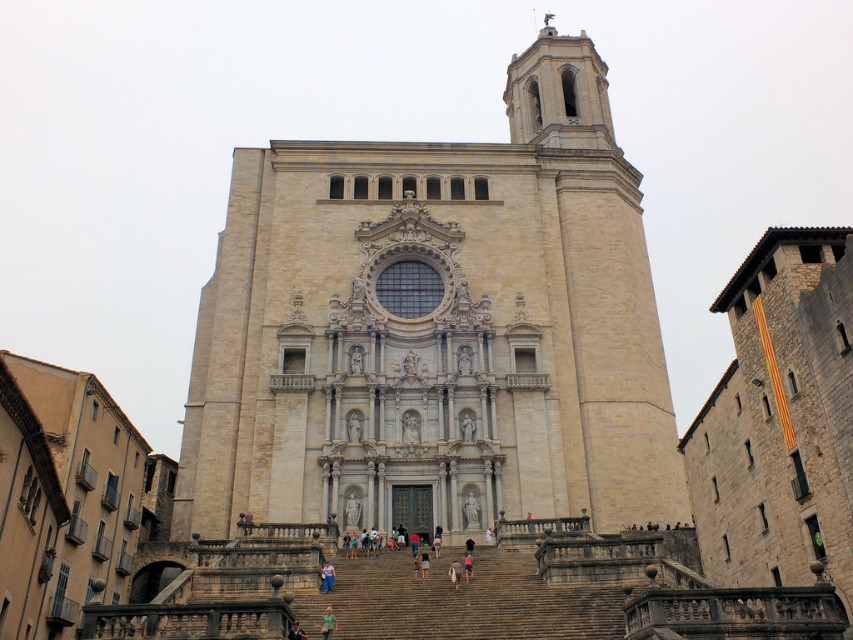
Question: Is green fabric bag at center bigger than light brown stone person at center?

Choices:
 (A) yes
 (B) no

Answer: (A)

Question: Does light brown stone person at center have a lesser width compared to green fabric shirt at center?

Choices:
 (A) no
 (B) yes

Answer: (B)

Question: Which point is closer to the camera taking this photo?

Choices:
 (A) (451, 563)
 (B) (329, 637)
 (C) (575, 618)

Answer: (B)

Question: Is green fabric bag at center positioned before light brown stone person at center?

Choices:
 (A) yes
 (B) no

Answer: (A)

Question: Among these objects, which one is farthest from the camera?

Choices:
 (A) light brown leather shoes at center
 (B) light blue jeans at center

Answer: (A)

Question: Estimate the real-world distances between objects in this image. Which object is farther from the light brown leather shoes at center?

Choices:
 (A) brown stone stairs at center
 (B) beige stone tower at center
 (C) light blue jeans at center
 (D) green fabric bag at center

Answer: (B)